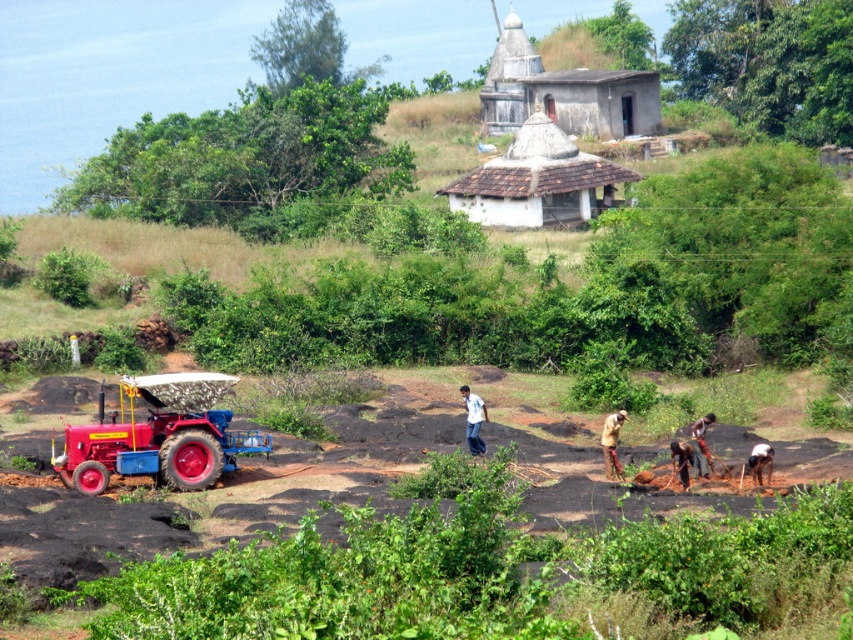
You are standing at the red tractor with a blue trailer on the uneven rocky terrain. You see two points marked in the image. Which point is closer to you, point (708, 422) or point (682, 442)?

Point (708, 422) is in front of point (682, 442), so it is closer to you.